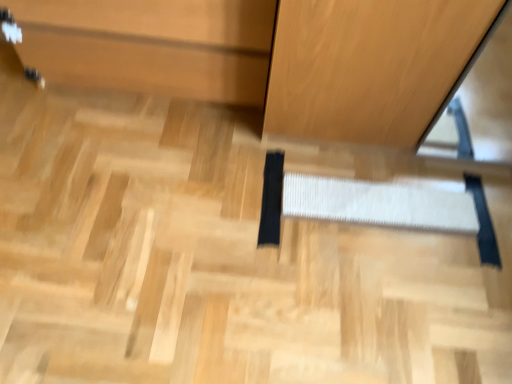
Question: Does point (184, 54) appear closer or farther from the camera than point (455, 223)?

Choices:
 (A) farther
 (B) closer

Answer: (B)

Question: In the image, is matte wood cabinet at upper left on the left side or the right side of white woven stair at center?

Choices:
 (A) left
 (B) right

Answer: (A)

Question: From the image's perspective, is matte wood cabinet at upper left positioned above or below white woven stair at center?

Choices:
 (A) below
 (B) above

Answer: (B)

Question: In terms of size, does white woven stair at center appear bigger or smaller than matte wood cabinet at upper left?

Choices:
 (A) big
 (B) small

Answer: (B)

Question: Considering the positions of point coord(373,198) and point coord(253,77), is point coord(373,198) closer or farther from the camera than point coord(253,77)?

Choices:
 (A) farther
 (B) closer

Answer: (B)

Question: From a real-world perspective, relative to matte wood cabinet at upper left, is white woven stair at center vertically above or below?

Choices:
 (A) below
 (B) above

Answer: (A)

Question: From the image's perspective, relative to matte wood cabinet at upper left, is white woven stair at center above or below?

Choices:
 (A) above
 (B) below

Answer: (B)